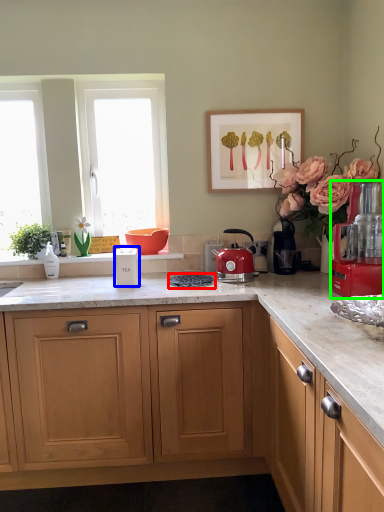
Question: Which object is positioned closest to gas stove (highlighted by a red box)? Select from kitchen appliance (highlighted by a blue box) and kitchen appliance (highlighted by a green box).

Choices:
 (A) kitchen appliance
 (B) kitchen appliance

Answer: (A)